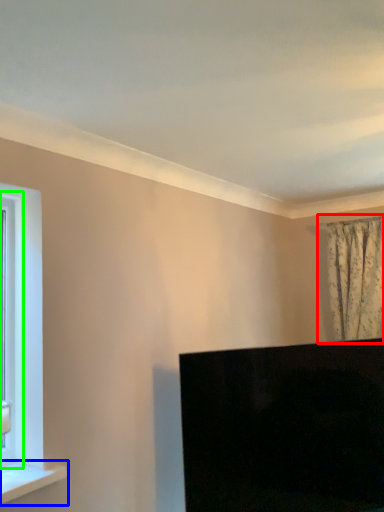
Question: Estimate the real-world distances between objects in this image. Which object is closer to curtain (highlighted by a red box), window sill (highlighted by a blue box) or window frame (highlighted by a green box)?

Choices:
 (A) window sill
 (B) window frame

Answer: (A)